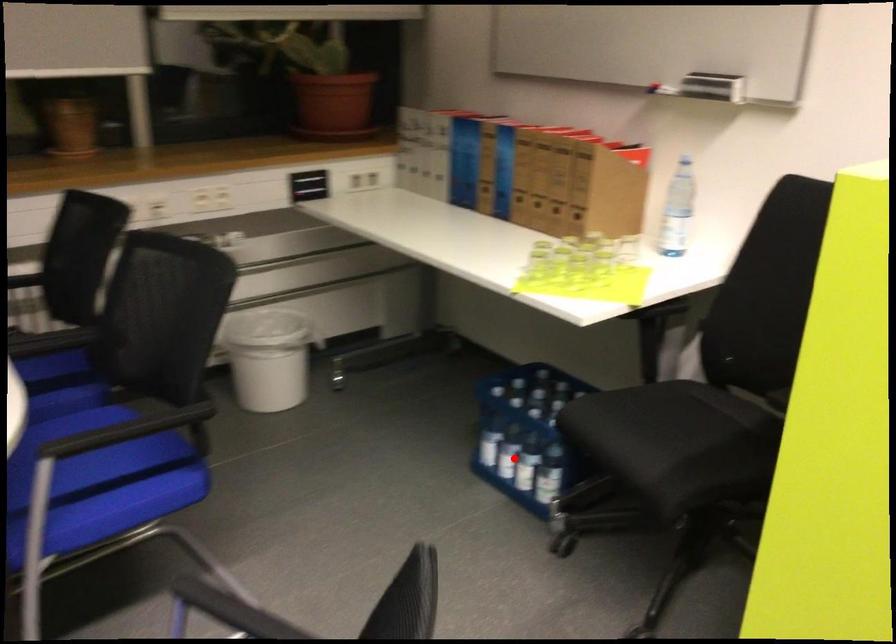
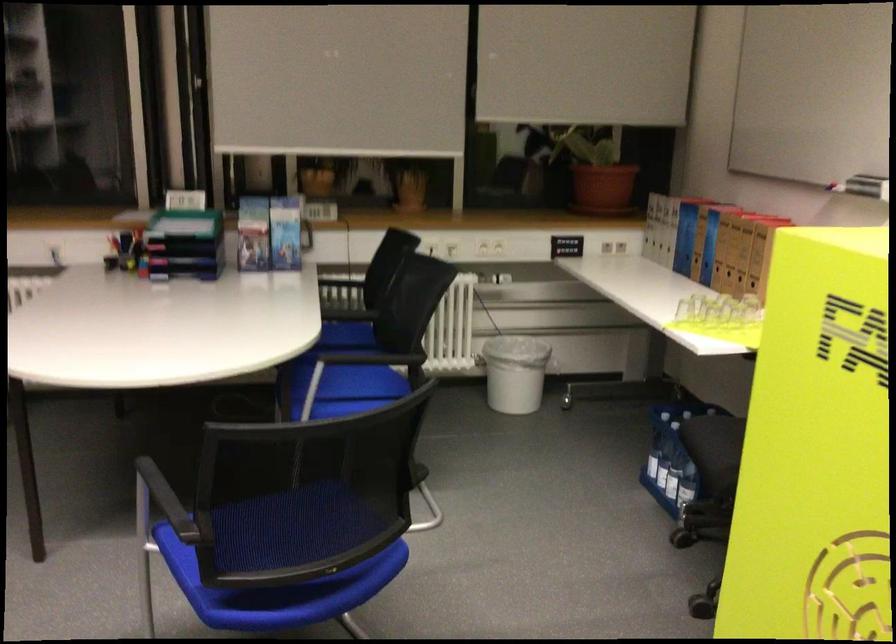
The point at the highlighted location is marked in the first image. Where is the corresponding point in the second image?

(667, 471)